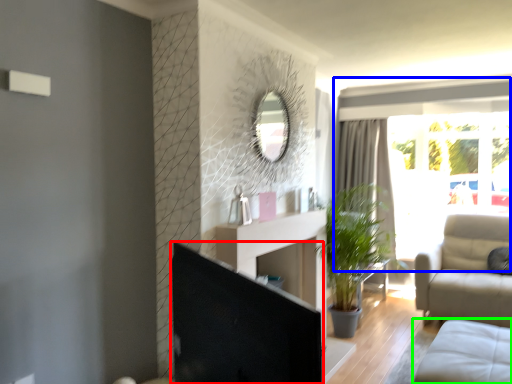
Question: Which object is the farthest from screen door (highlighted by a red box)? Choose among these: window (highlighted by a blue box) or studio couch (highlighted by a green box).

Choices:
 (A) window
 (B) studio couch

Answer: (A)